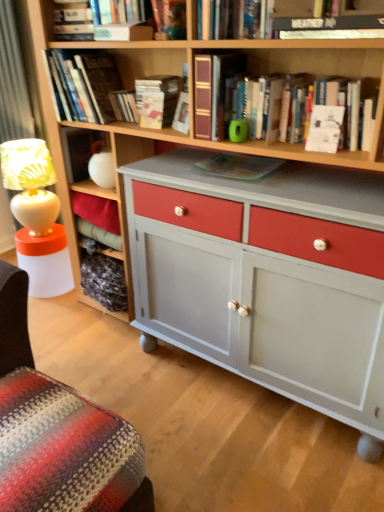
Where is `white paper at upper center, the 1th paperback book from the front`? white paper at upper center, the 1th paperback book from the front is located at coordinates (325, 128).

What do you see at coordinates (238, 166) in the screenshot?
I see `matte green paperback book at center, placed as the second paperback book when sorted from front to back` at bounding box center [238, 166].

The image size is (384, 512). What do you see at coordinates (30, 183) in the screenshot?
I see `white fabric lampshade at left` at bounding box center [30, 183].

Measure the distance between point (106, 55) and camera.

Point (106, 55) and camera are 1.93 meters apart from each other.

This screenshot has height=512, width=384. In order to click on white paper at upper center, the 1th paperback book from the front in this screenshot , I will do `click(325, 128)`.

Considering the relative sizes of matte paper book at upper center, the fourth book when ordered from left to right, and matte plastic book at upper center, marked as the 3th book in a right-to-left arrangement, in the image provided, is matte paper book at upper center, the fourth book when ordered from left to right, thinner than matte plastic book at upper center, marked as the 3th book in a right-to-left arrangement,?

No, matte paper book at upper center, the fourth book when ordered from left to right, is not thinner than matte plastic book at upper center, marked as the 3th book in a right-to-left arrangement.

Considering the sizes of matte paper book at upper center, acting as the 4th book starting from the right, and matte plastic book at upper center, marked as the 3th book in a right-to-left arrangement, in the image, is matte paper book at upper center, acting as the 4th book starting from the right, bigger or smaller than matte plastic book at upper center, marked as the 3th book in a right-to-left arrangement,?

matte paper book at upper center, acting as the 4th book starting from the right, is bigger than matte plastic book at upper center, marked as the 3th book in a right-to-left arrangement.

Which is in front, point (150, 123) or point (160, 33)?

Positioned in front is point (160, 33).

Is white paper at upper center, the 1th paperback book from the front, completely or partially inside matte paper book at upper center, acting as the 4th book starting from the right?

Actually, white paper at upper center, the 1th paperback book from the front, is outside matte paper book at upper center, acting as the 4th book starting from the right.

Consider the image. From a real-world perspective, between matte paper book at upper center, acting as the 4th book starting from the right, and white paper at upper center, the 1th paperback book from the front, who is vertically lower?

white paper at upper center, the 1th paperback book from the front.

How far apart are matte paper book at upper center, acting as the 4th book starting from the right, and white paper at upper center, the 1th paperback book viewed from the right?

matte paper book at upper center, acting as the 4th book starting from the right, and white paper at upper center, the 1th paperback book viewed from the right, are 28.45 inches apart.

Based on the photo, does matte paper book at upper center, acting as the 4th book starting from the right, lie in front of white paper at upper center, the fourth paperback book in the left-to-right sequence?

No, it is behind white paper at upper center, the fourth paperback book in the left-to-right sequence.

Can you tell me how much leather-bound book at center, which appears as the 7th book when viewed from the left, and hardcover book at upper center, the 6th book when ordered from left to right, differ in facing direction?

leather-bound book at center, which appears as the 7th book when viewed from the left, and hardcover book at upper center, the 6th book when ordered from left to right, are facing 0.000359 degrees away from each other.

Is leather-bound book at center, positioned as the 1th book in right-to-left order, far away from hardcover book at upper center, the 6th book when ordered from left to right?

No, there isn't a large distance between leather-bound book at center, positioned as the 1th book in right-to-left order, and hardcover book at upper center, the 6th book when ordered from left to right.

Is leather-bound book at center, positioned as the 1th book in right-to-left order, further to camera compared to hardcover book at upper center, the 6th book when ordered from left to right?

Yes.

Would you say leather-bound book at center, positioned as the 1th book in right-to-left order, is outside hardcover book at upper center, the 2th book in the right-to-left sequence?

Yes, leather-bound book at center, positioned as the 1th book in right-to-left order, is outside of hardcover book at upper center, the 2th book in the right-to-left sequence.

From the picture: From a real-world perspective, which is physically above, hardcover book at upper center, which appears as the 4th paperback book when viewed from the front, or white fabric lampshade at left?

hardcover book at upper center, which appears as the 4th paperback book when viewed from the front, from a real-world perspective.

Considering the relative sizes of hardcover book at upper center, the first paperback book in the back-to-front sequence, and white fabric lampshade at left in the image provided, is hardcover book at upper center, the first paperback book in the back-to-front sequence, smaller than white fabric lampshade at left?

Correct, hardcover book at upper center, the first paperback book in the back-to-front sequence, occupies less space than white fabric lampshade at left.

In order to click on table lamp below the hardcover book at upper center, acting as the 1th paperback book starting from the left (from the image's perspective) in this screenshot , I will do `click(30, 183)`.

Can you tell me how much hardcover book at upper center, the first paperback book in the back-to-front sequence, and white fabric lampshade at left differ in facing direction?

There is a 0.000456-degree angle between the facing directions of hardcover book at upper center, the first paperback book in the back-to-front sequence, and white fabric lampshade at left.

From a real-world perspective, which object stands above the other?

matte paper book at upper center, the fourth book when ordered from left to right.

Is matte paper book at upper center, acting as the 4th book starting from the right, positioned before matte paper at upper center, positioned as the 3th paperback book in right-to-left order?

No.

Is matte paper book at upper center, acting as the 4th book starting from the right, to the right of matte paper at upper center, placed as the third paperback book when sorted from front to back, from the viewer's perspective?

Yes.

Would you say matte paper book at upper center, acting as the 4th book starting from the right, is a long distance from matte paper at upper center, positioned as the 3th paperback book in right-to-left order?

No, there isn't a large distance between matte paper book at upper center, acting as the 4th book starting from the right, and matte paper at upper center, positioned as the 3th paperback book in right-to-left order.

Is matte paper at upper center, placed as the third paperback book when sorted from front to back, outside of matte green paperback book at center, placed as the second paperback book when sorted from front to back?

Yes, matte paper at upper center, placed as the third paperback book when sorted from front to back, is outside of matte green paperback book at center, placed as the second paperback book when sorted from front to back.

Which is in front, point (160, 108) or point (267, 164)?

Positioned in front is point (267, 164).

Is matte paper at upper center, placed as the third paperback book when sorted from front to back, taller than matte green paperback book at center, placed as the second paperback book when sorted from front to back?

Yes, matte paper at upper center, placed as the third paperback book when sorted from front to back, is taller than matte green paperback book at center, placed as the second paperback book when sorted from front to back.

Would you say matte plastic book at upper center, the fifth book in the left-to-right sequence, contains white fabric lampshade at left?

No, white fabric lampshade at left is not a part of matte plastic book at upper center, the fifth book in the left-to-right sequence.

From a real-world perspective, relative to white fabric lampshade at left, is matte plastic book at upper center, the fifth book in the left-to-right sequence, vertically above or below?

In terms of real-world spatial position, matte plastic book at upper center, the fifth book in the left-to-right sequence, is above white fabric lampshade at left.

Which object is positioned more to the left, matte plastic book at upper center, the fifth book in the left-to-right sequence, or white fabric lampshade at left?

white fabric lampshade at left.

How far apart are matte plastic book at upper center, marked as the 3th book in a right-to-left arrangement, and white fabric lampshade at left?

The distance of matte plastic book at upper center, marked as the 3th book in a right-to-left arrangement, from white fabric lampshade at left is 3.88 feet.

Which book is the 3rd one when counting from the front of the matte paper book at upper center, the fourth book when ordered from left to right? Please provide its 2D coordinates.

[(169, 19)]

Identify the location of the 4th book to the left when counting from the white paper at upper center, the fourth paperback book in the left-to-right sequence. The height and width of the screenshot is (512, 384). (157, 100).

Based on their spatial positions, is white paper at upper center, which is counted as the 4th paperback book, starting from the back, or hardcover book at upper left, positioned as the sixth book in right-to-left order, further from matte green paperback book at center, the 3th paperback book from the left?

The object further to matte green paperback book at center, the 3th paperback book from the left, is hardcover book at upper left, positioned as the sixth book in right-to-left order.

Consider the image. Looking at the image, which one is located further to matte paper at upper center, positioned as the 3th paperback book in right-to-left order, hardcover book at upper center, the first paperback book in the back-to-front sequence, or hardcover book at upper center, the fifth book positioned from the right?

The object further to matte paper at upper center, positioned as the 3th paperback book in right-to-left order, is hardcover book at upper center, the fifth book positioned from the right.

When comparing their distances from matte paper book at upper center, acting as the 4th book starting from the right, does hardcover book at upper left, positioned as the sixth book in right-to-left order, or hardcover book at upper center, which appears as the 4th paperback book when viewed from the front, seem closer?

hardcover book at upper center, which appears as the 4th paperback book when viewed from the front, lies closer to matte paper book at upper center, acting as the 4th book starting from the right, than the other object.

Based on their spatial positions, is leather-bound book at center, which appears as the 7th book when viewed from the left, or hardcover book at upper left, positioned as the sixth book in right-to-left order, further from hardcover book at upper center, the 6th book when ordered from left to right?

hardcover book at upper left, positioned as the sixth book in right-to-left order, is positioned further to the anchor hardcover book at upper center, the 6th book when ordered from left to right.

When comparing their distances from white paper at upper center, the 1th paperback book from the front, does leather-bound book at center, which appears as the 7th book when viewed from the left, or matte paper book at upper center, acting as the 4th book starting from the right, seem closer?

leather-bound book at center, which appears as the 7th book when viewed from the left, is closer to white paper at upper center, the 1th paperback book from the front.

Which object lies further to the anchor point hardcover book at upper left, positioned as the sixth book in right-to-left order, hardcover book at upper center, which is counted as the 1th book, starting from the left, or white paper at upper center, the fourth paperback book in the left-to-right sequence?

Among the two, white paper at upper center, the fourth paperback book in the left-to-right sequence, is located further to hardcover book at upper left, positioned as the sixth book in right-to-left order.

In the scene shown: Estimate the real-world distances between objects in this image. Which object is further from matte plastic book at upper center, marked as the 3th book in a right-to-left arrangement, hardcover book at upper center, the first paperback book in the back-to-front sequence, or leather-bound book at center, which appears as the 7th book when viewed from the left?

Among the two, hardcover book at upper center, the first paperback book in the back-to-front sequence, is located further to matte plastic book at upper center, marked as the 3th book in a right-to-left arrangement.

From the image, which object appears to be farther from matte green paperback book at center, the third paperback book in the back-to-front sequence, matte paper at upper center, placed as the third paperback book when sorted from front to back, or matte paper book at upper center, acting as the 4th book starting from the right?

Based on the image, matte paper at upper center, placed as the third paperback book when sorted from front to back, appears to be further to matte green paperback book at center, the third paperback book in the back-to-front sequence.

Locate an element on the screen. book between hardcover book at upper left, positioned as the sixth book in right-to-left order, and matte paper book at upper center, the fourth book when ordered from left to right, from left to right is located at coordinates (93, 27).

What are the coordinates of `paperback book located between hardcover book at upper center, the fifth book positioned from the right, and hardcover book at upper center, the 2th book in the right-to-left sequence, in the left-right direction` in the screenshot? It's located at (152, 109).

Identify the location of paperback book between hardcover book at upper center, the seventh book from the right, and matte paper at upper center, which is counted as the 2th paperback book, starting from the left, vertically. (124, 106).

Image resolution: width=384 pixels, height=512 pixels. I want to click on paperback book between hardcover book at upper center, the first paperback book in the back-to-front sequence, and leather-bound book at center, which appears as the 7th book when viewed from the left, so click(x=152, y=109).